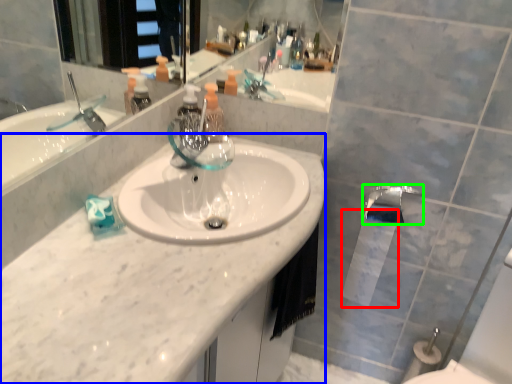
Question: Estimate the real-world distances between objects in this image. Which object is closer to toilet paper (highlighted by a red box), counter top (highlighted by a blue box) or tap (highlighted by a green box)?

Choices:
 (A) counter top
 (B) tap

Answer: (B)